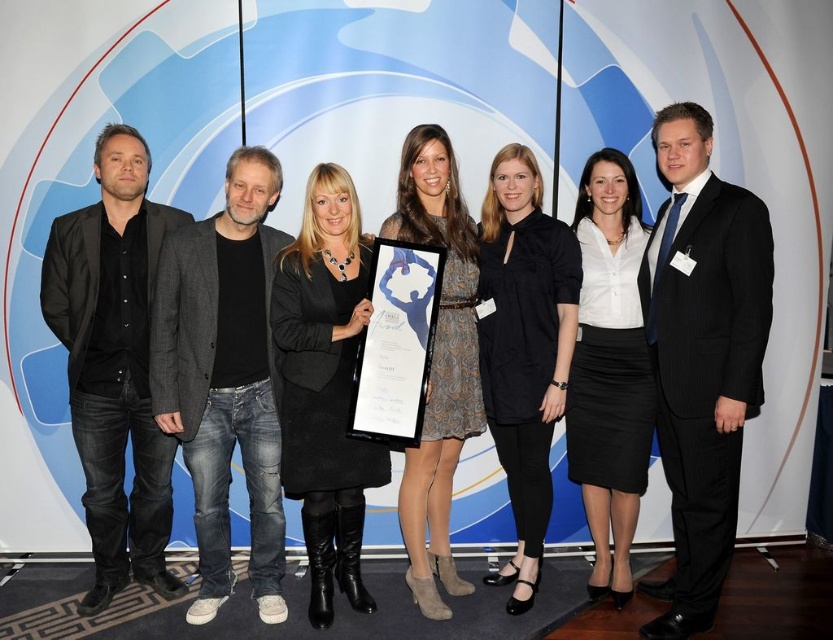
You are a photographer adjusting the camera focus for the group photo. The camera is currently focused on the black pinstripe suit at center. Will the black denim jeans at left also be in focus if the depth of field is set to 1 meter?

The black pinstripe suit at center is closer to the viewer than the black denim jeans at left. If the depth of field is set to 1 meter, the distance between them must be within that range for both to be in focus. Since the exact distance isn

Based on the scene description, where exactly is the black pinstripe suit at center located in terms of coordinates?

The black pinstripe suit at center is located at coordinates point (701, 356).

You are a photographer adjusting the camera settings to ensure all subjects are in focus. Given that the black pinstripe suit at center and the black denim jeans at left are different heights, which subject should you adjust the focus for first to ensure proper depth of field?

The black pinstripe suit at center is much taller than the black denim jeans at left, so you should adjust the focus for the black pinstripe suit at center first to account for its greater height and ensure proper depth of field.